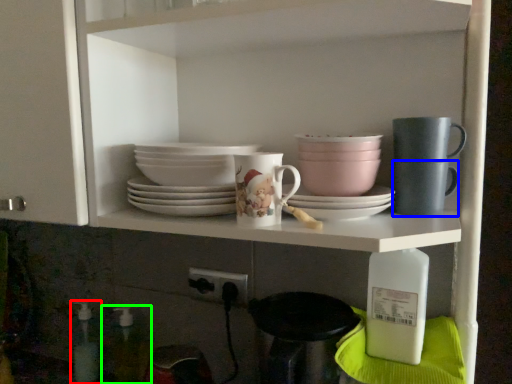
Question: Which object is the farthest from bottle (highlighted by a red box)? Choose among these: mug (highlighted by a blue box) or bottle (highlighted by a green box).

Choices:
 (A) mug
 (B) bottle

Answer: (A)